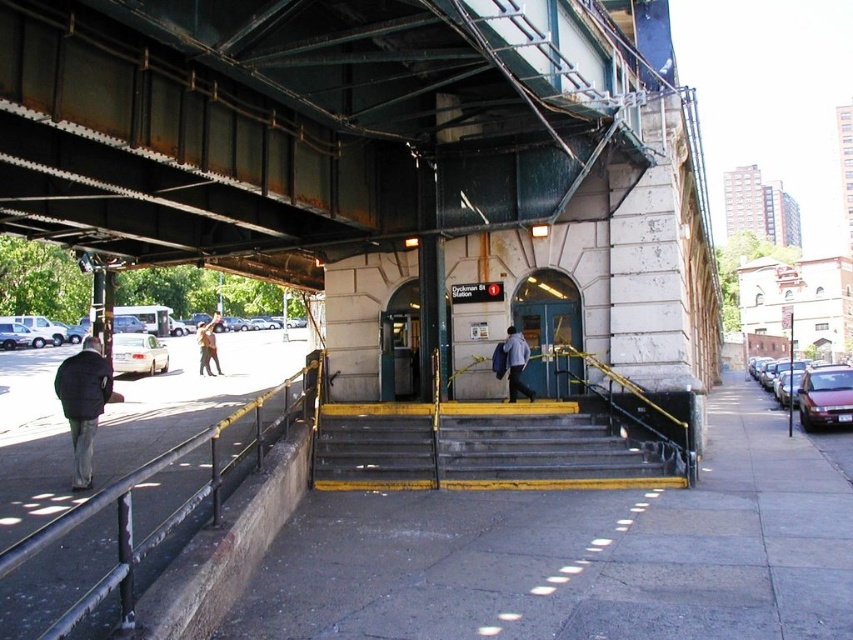
You are a passenger standing at the subway entrance. You see a green glass door at center and a light blue shirt at center. Which object is positioned to the right of the other?

The green glass door at center is to the right of the light blue shirt at center.

You are standing at the subway entrance and want to know which of the two points, point (520, 296) or point (527, 358), is closer to you. Can you determine this based on their positions?

Point (520, 296) is closer to you because it is further to the viewer than point (527, 358).